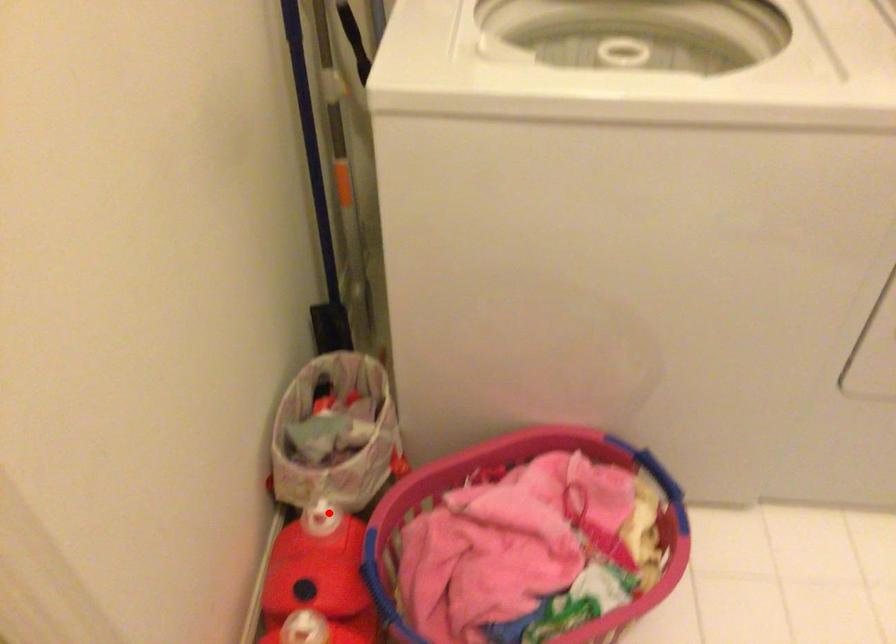
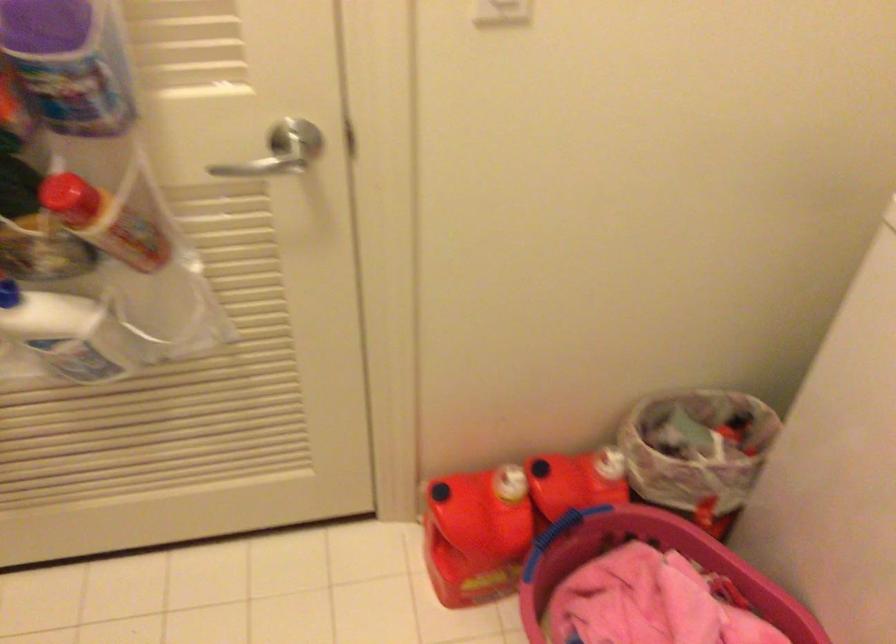
The point at the highlighted location is marked in the first image. Where is the corresponding point in the second image?

(618, 468)